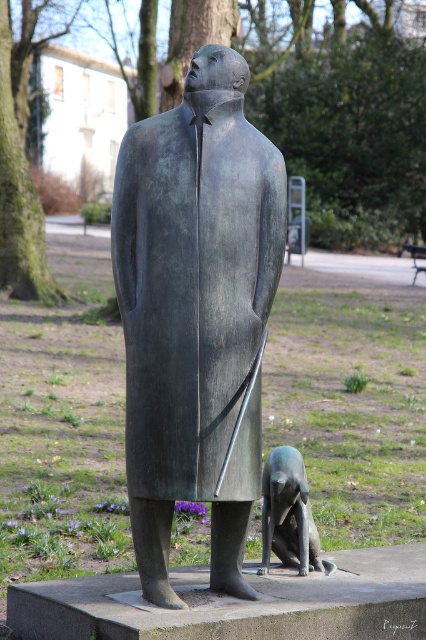
You are a visitor at the park and want to take a photo of the bronze dog at lower center and the wooden park bench at center. Which object is taller so that it can be framed properly in the photo?

The bronze dog at lower center is taller than the wooden park bench at center, so it should be framed to accommodate its height.

You are standing in a park and see the bronze statue at center. If you want to take a photo of it from a distance where it appears small in the frame, would 7.82 meters be a suitable distance?

Yes, the bronze statue at center is 7.82 meters away from the camera, so standing at that distance would make it appear small in the frame.